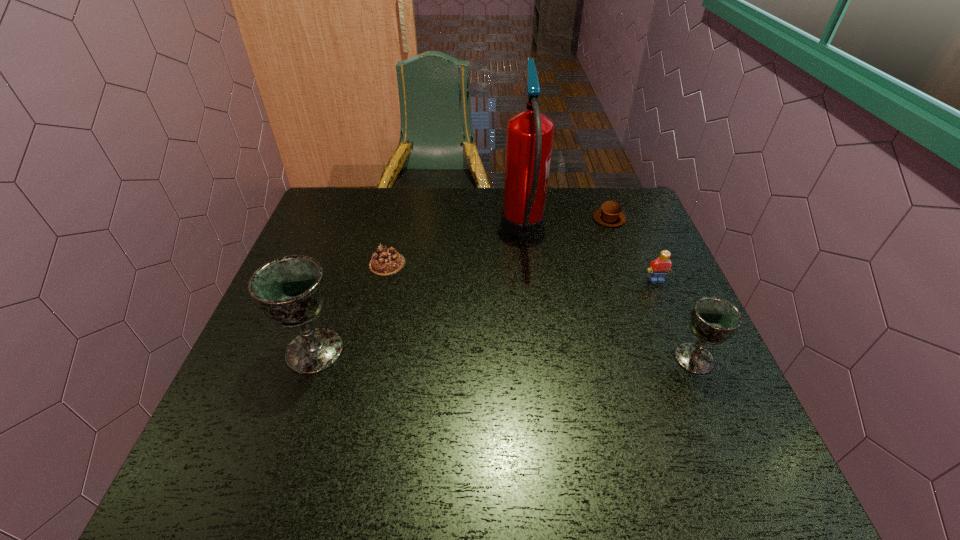
Where is `muffin that is at the right edge`? muffin that is at the right edge is located at coordinates (609, 214).

The width and height of the screenshot is (960, 540). I want to click on Lego at the right edge, so click(x=660, y=267).

I want to click on object positioned at the far right corner, so click(x=609, y=214).

Find the location of a particular element. vacant space at the far edge of the desktop is located at coordinates (477, 199).

The width and height of the screenshot is (960, 540). Find the location of `vacant space at the near edge of the desktop`. vacant space at the near edge of the desktop is located at coordinates point(568,415).

Identify the location of vacant region at the left edge. (333, 318).

Where is `vacant space at the right edge of the desktop`? The image size is (960, 540). vacant space at the right edge of the desktop is located at coordinates (612, 249).

At what (x,y) coordinates should I click in order to perform the action: click on free spot at the far left corner of the desktop. Please return your answer as a coordinate pair (x, y). Looking at the image, I should click on (317, 226).

In the image, there is a desktop. Where is `free space at the far right corner`? This screenshot has height=540, width=960. free space at the far right corner is located at coordinates (634, 222).

I want to click on free space that is in between the third tallest object and the fourth object from right to left, so click(x=609, y=294).